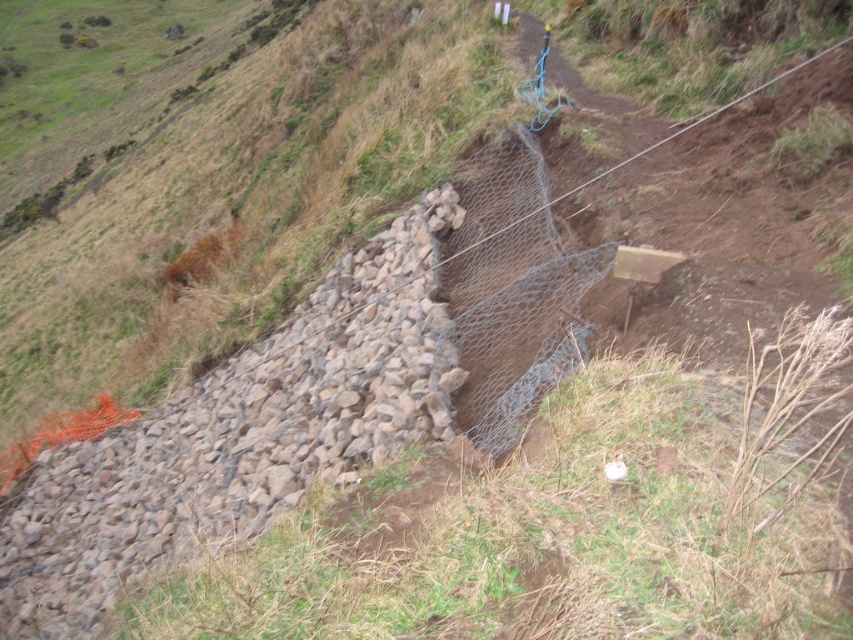
Question: Is wire mesh at center positioned behind wire mesh fence at center?

Choices:
 (A) yes
 (B) no

Answer: (B)

Question: Is wire mesh at center above wire mesh fence at center?

Choices:
 (A) yes
 (B) no

Answer: (B)

Question: Which point is closer to the camera taking this photo?

Choices:
 (A) [x=531, y=170]
 (B) [x=488, y=401]

Answer: (B)

Question: In this image, where is wire mesh at center located relative to wire mesh fence at center?

Choices:
 (A) above
 (B) below

Answer: (B)